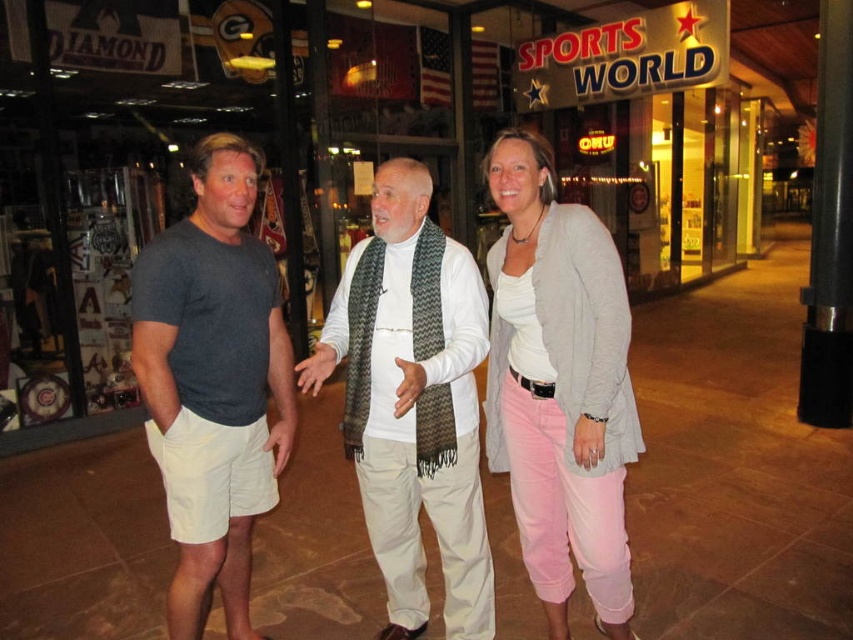
You are trying to decide which cardigan to wear for a casual evening out. You see both the gray cotton cardigan at center and the light gray textured cardigan at center in the image. Which one is positioned lower on the person?

The gray cotton cardigan at center is positioned lower because it is below the light gray textured cardigan at center.